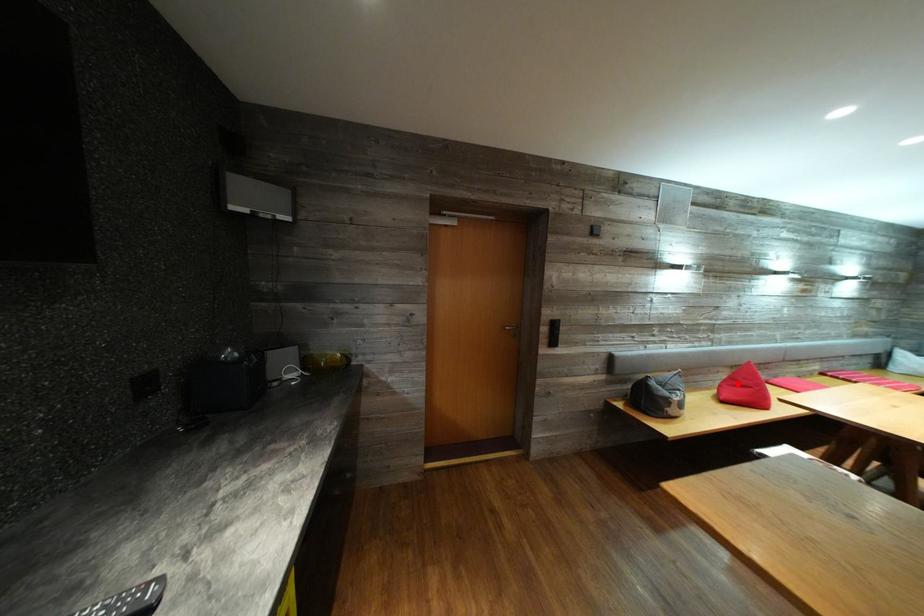
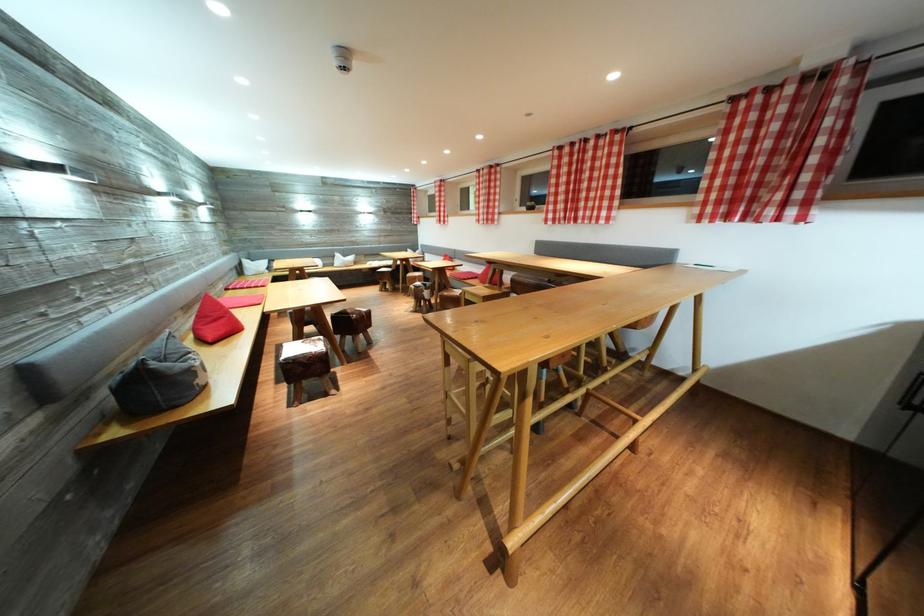
Question: I am providing you with two images of the same scene from different viewpoints. Image1 has a red point marked. In image2, the corresponding 3D location appears at what relative position? Reply with the corresponding letter.

Choices:
 (A) Closer
 (B) Farther

Answer: (A)